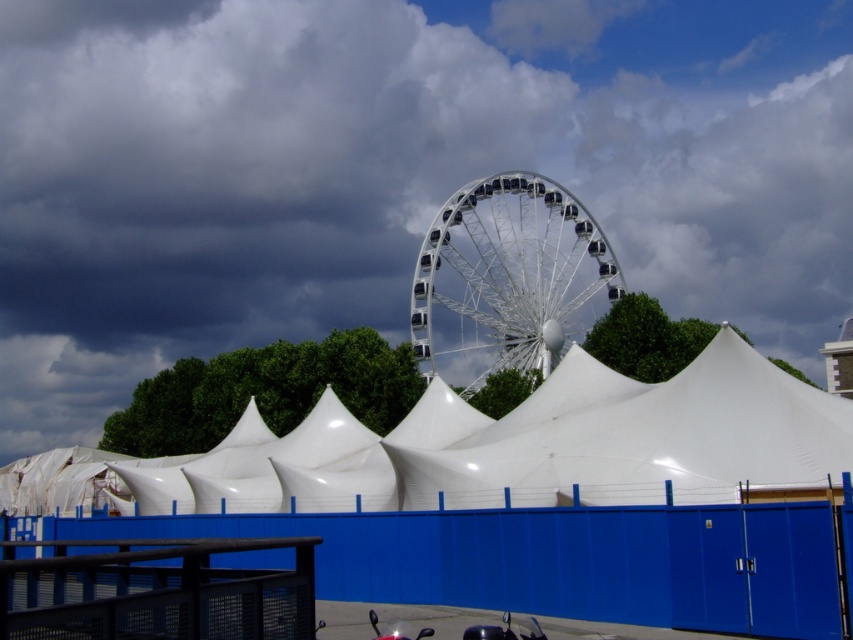
Which is in front, point (564, 70) or point (537, 346)?

Point (537, 346) is in front.

Is white fluffy cloud at upper center above white metallic ferris wheel at center?

Indeed, white fluffy cloud at upper center is positioned over white metallic ferris wheel at center.

What do you see at coordinates (393, 170) in the screenshot? This screenshot has height=640, width=853. I see `white fluffy cloud at upper center` at bounding box center [393, 170].

Where is `white fluffy cloud at upper center`? The height and width of the screenshot is (640, 853). white fluffy cloud at upper center is located at coordinates (393, 170).

Which is more to the right, white matte tent at center or white metallic ferris wheel at center?

white metallic ferris wheel at center is more to the right.

Does white matte tent at center have a lesser width compared to white metallic ferris wheel at center?

No.

Does point (698, 378) come farther from viewer compared to point (518, 182)?

No, it is in front of (518, 182).

Locate an element on the screen. The height and width of the screenshot is (640, 853). white matte tent at center is located at coordinates (503, 448).

Is white fluffy cloud at upper center wider than white matte tent at center?

Yes, white fluffy cloud at upper center is wider than white matte tent at center.

Which is more to the left, white fluffy cloud at upper center or white matte tent at center?

Positioned to the left is white matte tent at center.

Between point (662, 145) and point (802, 403), which one is positioned in front?

Point (802, 403)

The height and width of the screenshot is (640, 853). What are the coordinates of `white fluffy cloud at upper center` in the screenshot? It's located at (393, 170).